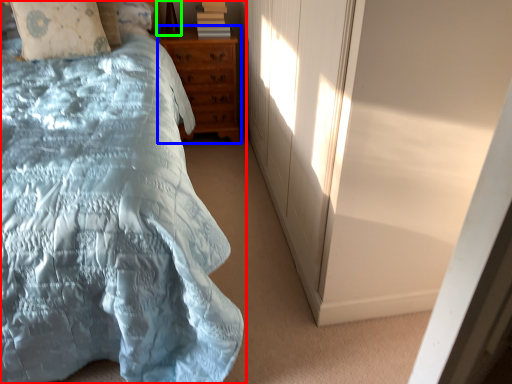
Question: Considering the real-world distances, which object is farthest from bed (highlighted by a red box)? chest of drawers (highlighted by a blue box) or table lamp (highlighted by a green box)?

Choices:
 (A) chest of drawers
 (B) table lamp

Answer: (B)